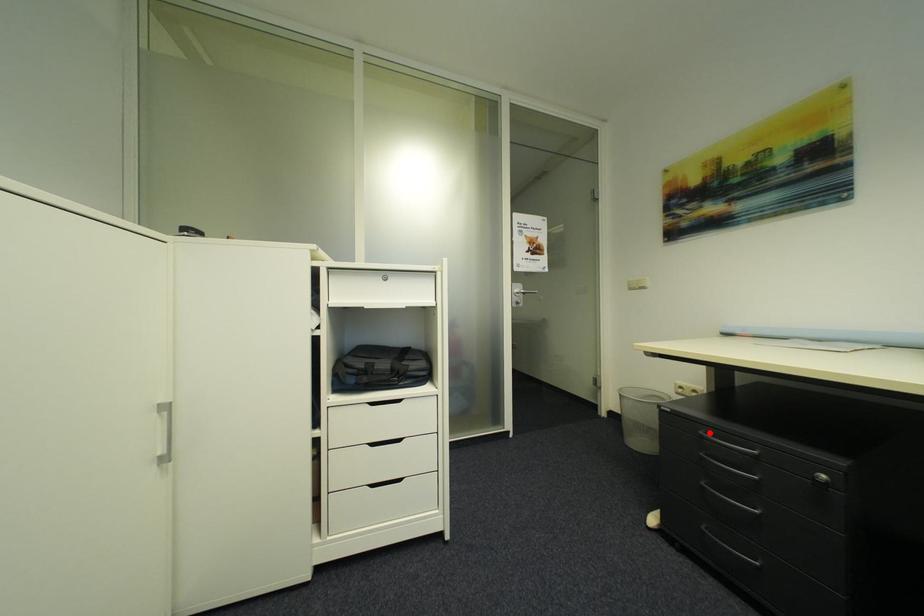
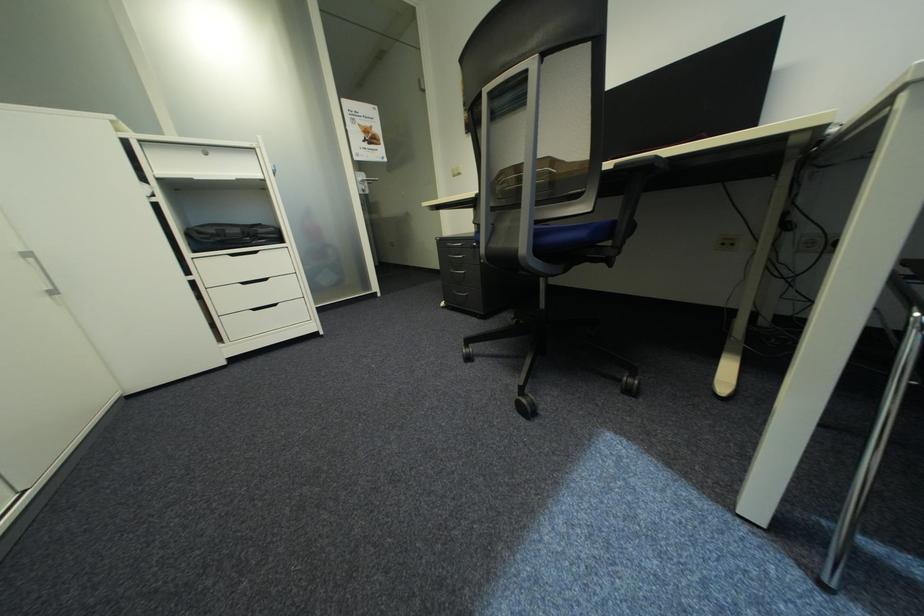
Locate, in the second image, the point that corresponds to the highlighted location in the first image.

(456, 245)